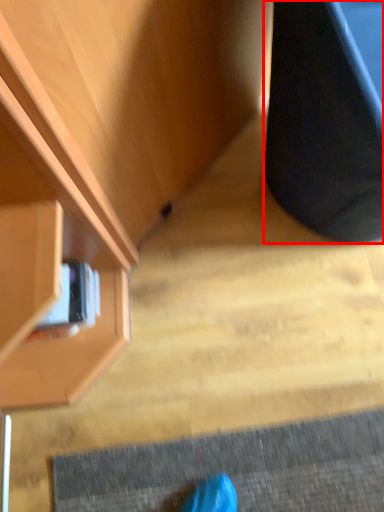
Question: From the image's perspective, where is furniture (annotated by the red box) located relative to cabinetry?

Choices:
 (A) below
 (B) above

Answer: (B)